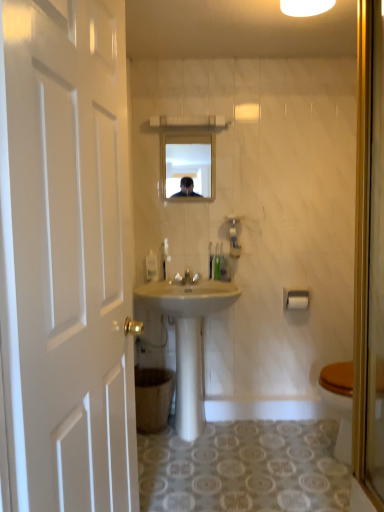
Locate an element on the screen. The image size is (384, 512). vacant space situated above white glossy sink at center (from a real-world perspective) is located at coordinates (189, 286).